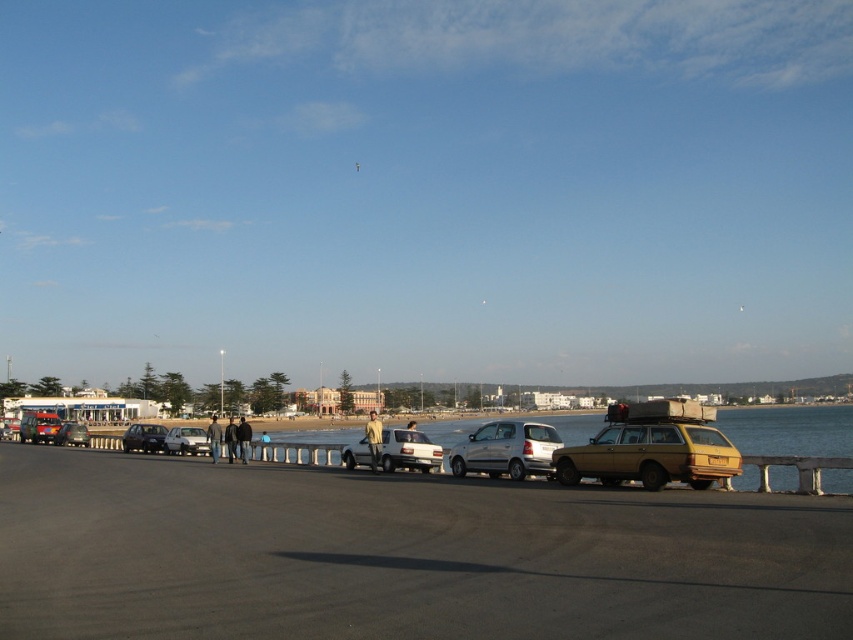
Is matte silver suv at center smaller than matte silver sedan at center?

Correct, matte silver suv at center occupies less space than matte silver sedan at center.

Which is more to the right, matte silver suv at center or matte silver sedan at center?

matte silver suv at center is more to the right.

Identify the location of matte silver suv at center. The height and width of the screenshot is (640, 853). (409, 451).

Can you confirm if matte black sedan at left is thinner than yellow matte license plate at center?

No, matte black sedan at left is not thinner than yellow matte license plate at center.

Does matte black sedan at left lie in front of yellow matte license plate at center?

No.

Which is in front, point (68, 428) or point (717, 465)?

Point (717, 465) is in front.

At what (x,y) coordinates should I click in order to perform the action: click on matte black sedan at left. Please return your answer as a coordinate pair (x, y). The width and height of the screenshot is (853, 640). Looking at the image, I should click on (73, 435).

Does gold metallic station wagon at center have a smaller size compared to shiny silver sedan at center?

Indeed, gold metallic station wagon at center has a smaller size compared to shiny silver sedan at center.

Can you confirm if gold metallic station wagon at center is bigger than shiny silver sedan at center?

No, gold metallic station wagon at center is not bigger than shiny silver sedan at center.

The image size is (853, 640). What do you see at coordinates (648, 456) in the screenshot?
I see `gold metallic station wagon at center` at bounding box center [648, 456].

The image size is (853, 640). In order to click on gold metallic station wagon at center in this screenshot , I will do `click(648, 456)`.